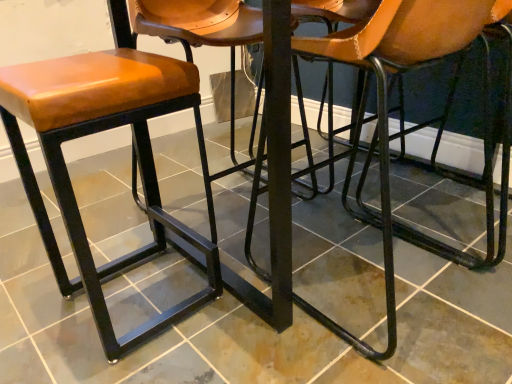
This screenshot has width=512, height=384. Find the location of `free spot below brown leather chair at center (from a real-world perspective)`. free spot below brown leather chair at center (from a real-world perspective) is located at coordinates (410, 302).